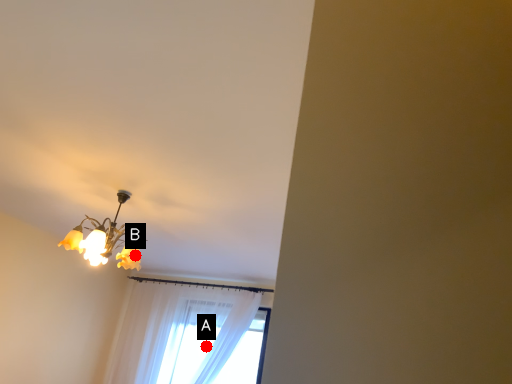
Question: Two points are circled on the image, labeled by A and B beside each circle. Which point is farther to the camera?

Choices:
 (A) A is further
 (B) B is further

Answer: (A)